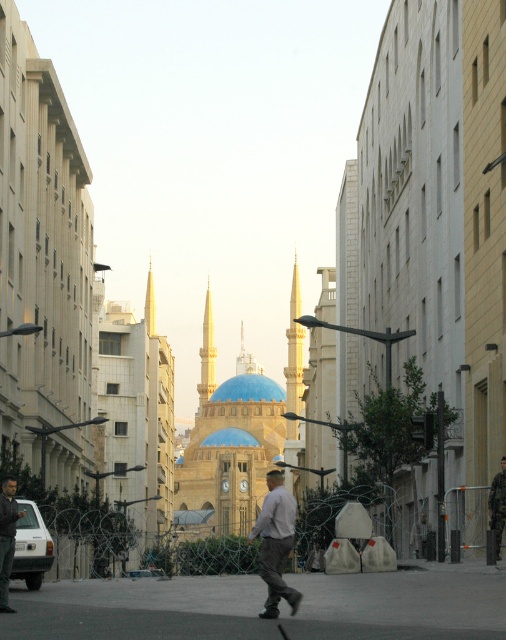
Which is more to the right, gray asphalt pavement at center or khaki cotton pants at center?

Positioned to the right is khaki cotton pants at center.

Between gray asphalt pavement at center and khaki cotton pants at center, which one appears on the left side from the viewer's perspective?

Positioned to the left is gray asphalt pavement at center.

Who is more forward, [130,592] or [501,516]?

Point [130,592] is more forward.

You are a GUI agent. You are given a task and a screenshot of the screen. Output one action in this format:
    pyautogui.click(x=<x>, y=<y>)
    Task: Click on the gray asphalt pavement at center
    The height and width of the screenshot is (640, 506).
    Given the screenshot: What is the action you would take?
    pyautogui.click(x=141, y=609)

Who is more distant from viewer, (13, 506) or (203, 388)?

Point (203, 388)

Is light brown leather jacket at center above light yellow stone spire at center?

Actually, light brown leather jacket at center is below light yellow stone spire at center.

Is point (12, 493) closer to viewer compared to point (207, 310)?

Yes.

Image resolution: width=506 pixels, height=640 pixels. Find the location of `light brown leather jacket at center`. light brown leather jacket at center is located at coordinates (7, 538).

Is light brown leather jacket at center below khaki cotton pants at center?

Correct, light brown leather jacket at center is located below khaki cotton pants at center.

Does light brown leather jacket at center lie in front of khaki cotton pants at center?

Yes, it is.

The width and height of the screenshot is (506, 640). Describe the element at coordinates (7, 538) in the screenshot. I see `light brown leather jacket at center` at that location.

The image size is (506, 640). In order to click on light brown leather jacket at center in this screenshot , I will do `click(7, 538)`.